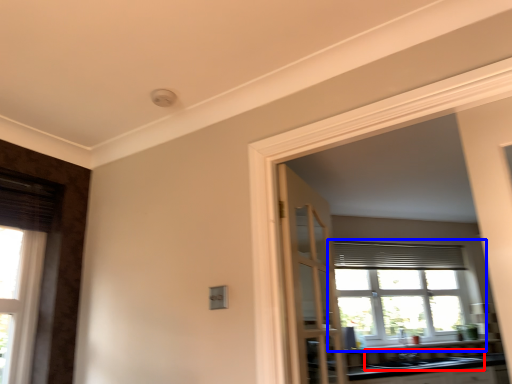
Question: Which object appears farthest to the camera in this image, sink (highlighted by a red box) or window (highlighted by a blue box)?

Choices:
 (A) sink
 (B) window

Answer: (B)